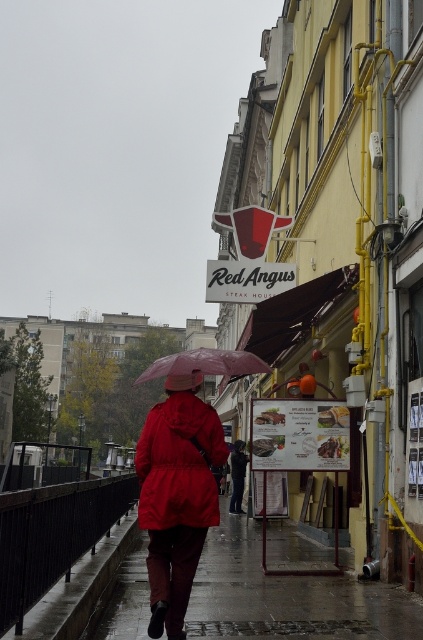
Consider the image. You are a delivery person trying to avoid getting your package wet. You see the wet asphalt pavement at lower center and the matte red jacket at center. Which surface should you place the package on to keep it dry?

You should place the package on the matte red jacket at center because the wet asphalt pavement at lower center is positioned under it, meaning the jacket is above and likely dry.

You are a delivery person trying to navigate through the rain. You see the wet asphalt pavement at lower center and the matte red jacket at center. Which object is higher up in the image?

The wet asphalt pavement at lower center is taller than the matte red jacket at center, so the wet asphalt pavement at lower center is higher up in the image.

You are a pedestrian caught in the rain. You see a person wearing a matte red jacket at center holding a transparent plastic umbrella at center. Can you stay under the umbrella to avoid getting wet?

The matte red jacket at center is positioned under the transparent plastic umbrella at center, so yes, you can stay under the umbrella to avoid getting wet.